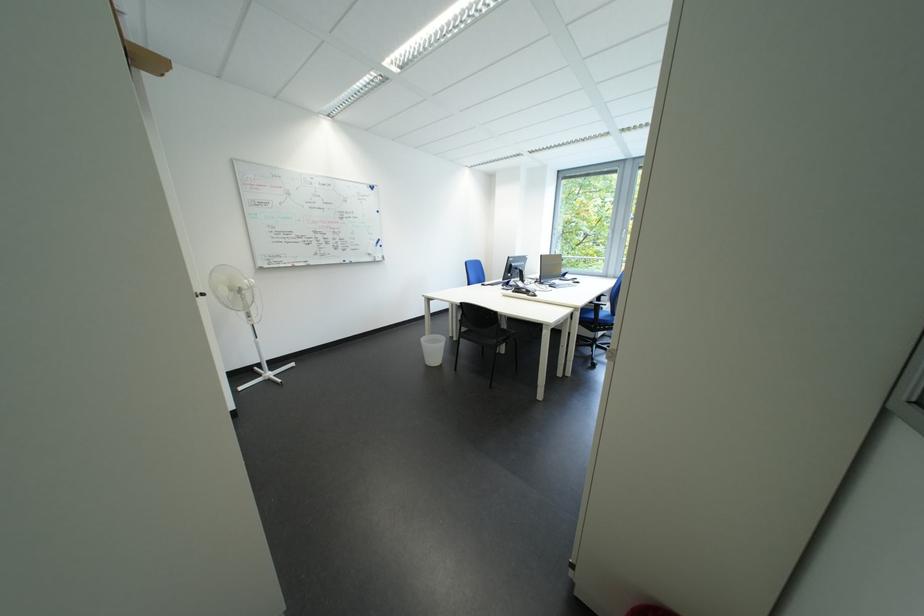
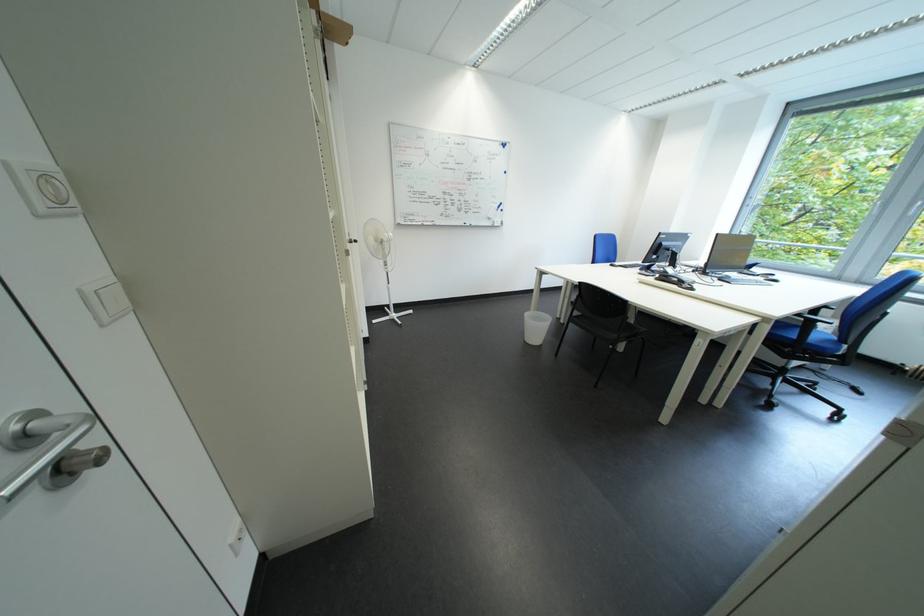
Find the pixel in the second image that matches (526,294) in the first image.

(669, 282)